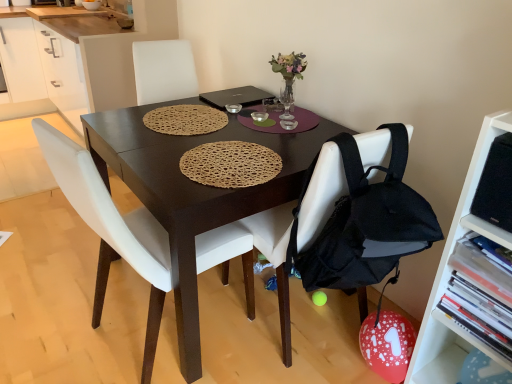
Locate an element on the screen. blank space to the left of dark wood table at center is located at coordinates (54, 283).